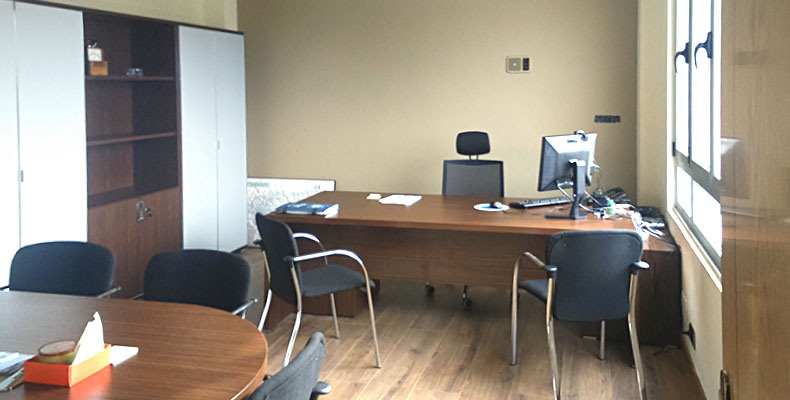
The width and height of the screenshot is (790, 400). I want to click on desk, so click(459, 254).